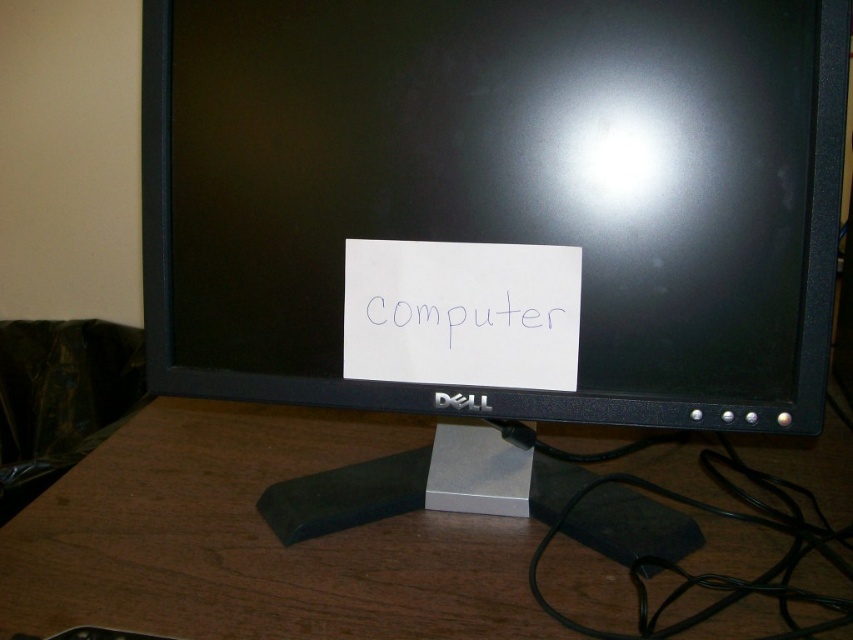
Question: Is black plastic monitor at center further to the viewer compared to brown wood computer desk at center?

Choices:
 (A) no
 (B) yes

Answer: (B)

Question: Among these objects, which one is nearest to the camera?

Choices:
 (A) brown wood computer desk at center
 (B) black plastic monitor at center

Answer: (A)

Question: Considering the real-world distances, which object is farthest from the white paper at center?

Choices:
 (A) brown wood computer desk at center
 (B) black plastic monitor at center

Answer: (A)

Question: Does black plastic monitor at center have a smaller size compared to brown wood computer desk at center?

Choices:
 (A) yes
 (B) no

Answer: (B)

Question: Among these objects, which one is farthest from the camera?

Choices:
 (A) black plastic monitor at center
 (B) white paper at center

Answer: (B)

Question: Does brown wood computer desk at center lie in front of white paper at center?

Choices:
 (A) no
 (B) yes

Answer: (B)